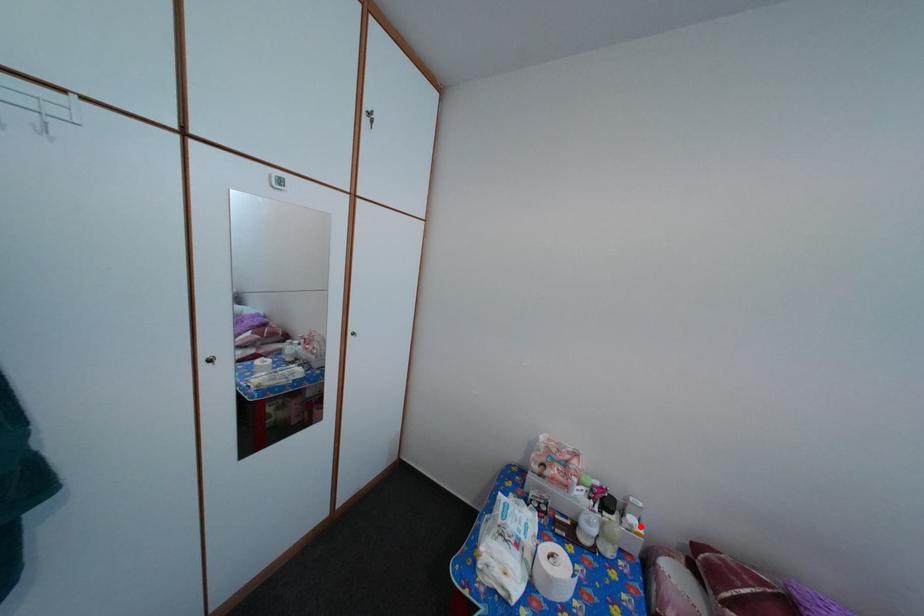
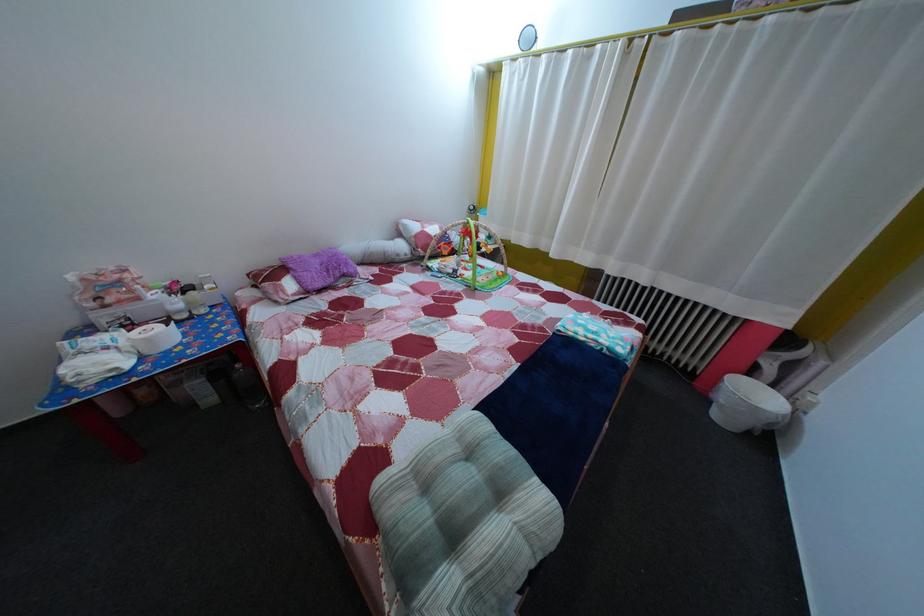
Where in the second image is the point corresponding to the highlighted location from the first image?

(216, 294)